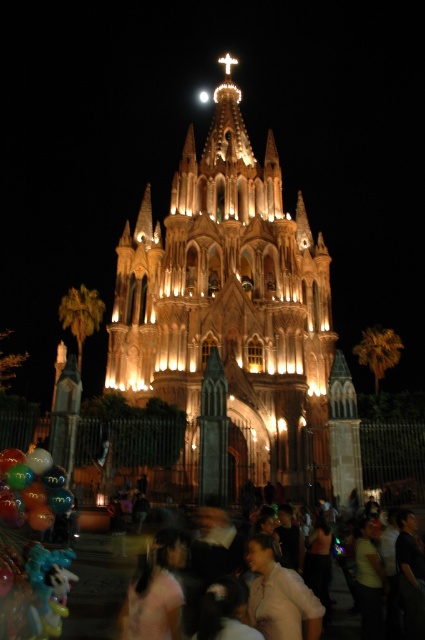
Does illuminated stone tower at center have a lesser height compared to blurred people at lower center?

No, illuminated stone tower at center is not shorter than blurred people at lower center.

Is illuminated stone tower at center to the left of blurred people at lower center from the viewer's perspective?

Indeed, illuminated stone tower at center is positioned on the left side of blurred people at lower center.

Is point (167, 360) positioned before point (382, 536)?

No, it is not.

The image size is (425, 640). I want to click on illuminated stone tower at center, so click(232, 304).

Which is more to the right, illuminated stone tower at center or light pink fabric at center?

light pink fabric at center

Does illuminated stone tower at center have a larger size compared to light pink fabric at center?

Yes.

Between point (328, 381) and point (291, 614), which one is positioned behind?

The point (328, 381) is more distant.

In order to click on illuminated stone tower at center in this screenshot , I will do `click(232, 304)`.

What do you see at coordinates (280, 596) in the screenshot? The height and width of the screenshot is (640, 425). I see `light pink fabric at center` at bounding box center [280, 596].

Does light pink fabric at center come in front of translucent glossy balloons at lower left?

Yes.

The height and width of the screenshot is (640, 425). Describe the element at coordinates (280, 596) in the screenshot. I see `light pink fabric at center` at that location.

Identify the location of light pink fabric at center. The image size is (425, 640). (280, 596).